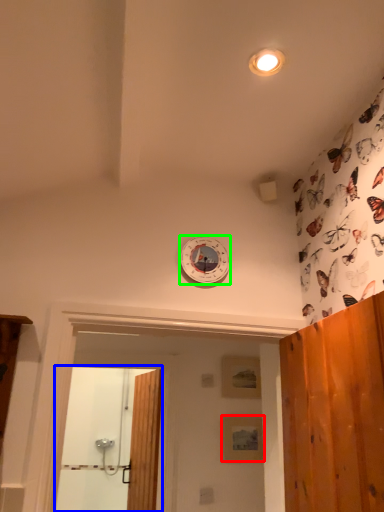
Question: Which object is the farthest from panel (highlighted by a red box)? Choose among these: screen door (highlighted by a blue box) or clock (highlighted by a green box).

Choices:
 (A) screen door
 (B) clock

Answer: (A)